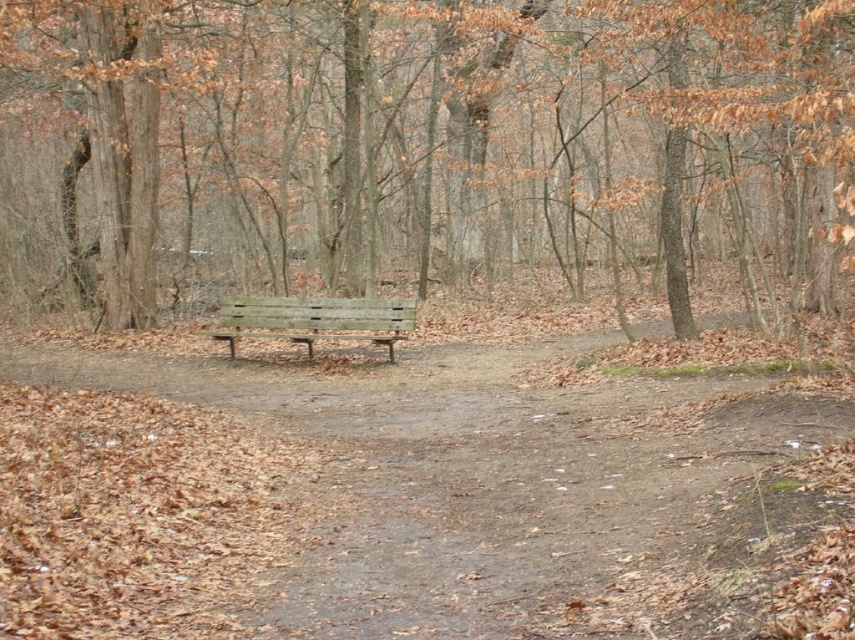
Question: Which object is farther from the camera taking this photo?

Choices:
 (A) brown dirt path at center
 (B) weathered wood bench at center
 (C) brown wood bench at center

Answer: (B)

Question: Can you confirm if brown dirt path at center is positioned above weathered wood bench at center?

Choices:
 (A) yes
 (B) no

Answer: (B)

Question: Which of these objects is positioned farthest from the brown dirt path at center?

Choices:
 (A) weathered wood bench at center
 (B) brown wood bench at center

Answer: (B)

Question: In this image, where is brown wood bench at center located relative to brown dirt path at center?

Choices:
 (A) below
 (B) above

Answer: (B)

Question: Can you confirm if brown wood bench at center is thinner than weathered wood bench at center?

Choices:
 (A) yes
 (B) no

Answer: (B)

Question: Which object is the farthest from the weathered wood bench at center?

Choices:
 (A) brown wood bench at center
 (B) brown dirt path at center

Answer: (A)